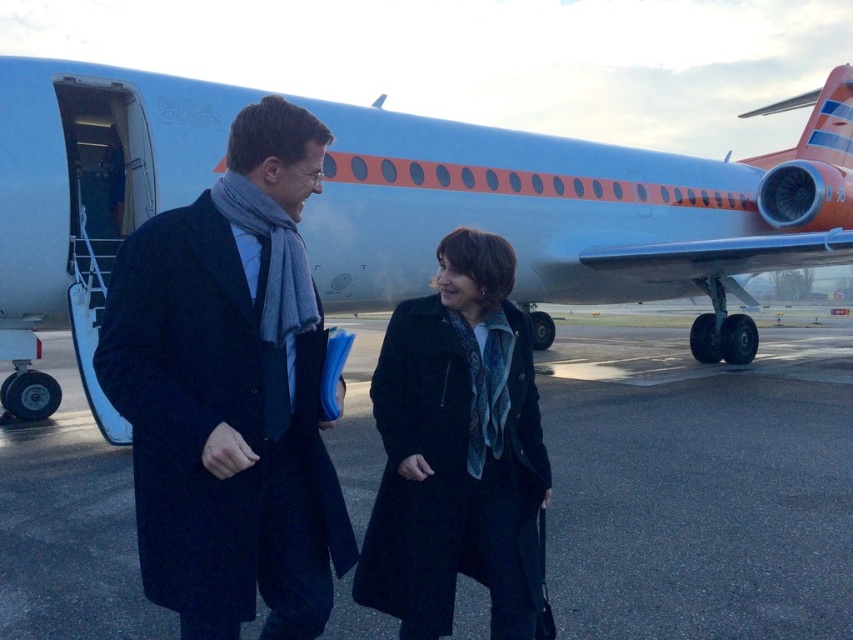
You are a photographer standing behind the two people in the scene. You want to take a photo that includes both the blue matte airplane at center and the dark blue wool coat at center. Which object will appear closer to the camera in the photo?

The blue matte airplane at center will appear closer to the camera in the photo because it is further to the viewer than the dark blue wool coat at center, meaning it is positioned nearer to the photographer.

You are a passenger trying to board the airplane. You see the blue matte airplane at center and the dark blue wool coat at center. Which object is closer to the boarding gate?

The dark blue wool coat at center is closer to the boarding gate because the blue matte airplane at center is to the right of it, implying the coat is positioned between the gate and the airplane.

You are a photographer at the airport and need to capture both the dark blue wool coat at center and the black wool coat at center in a single photo. Which coat should you adjust your camera angle to focus on to ensure both are in frame?

The dark blue wool coat at center is much taller than the black wool coat at center, so you should focus on the dark blue wool coat at center to ensure both are in frame.